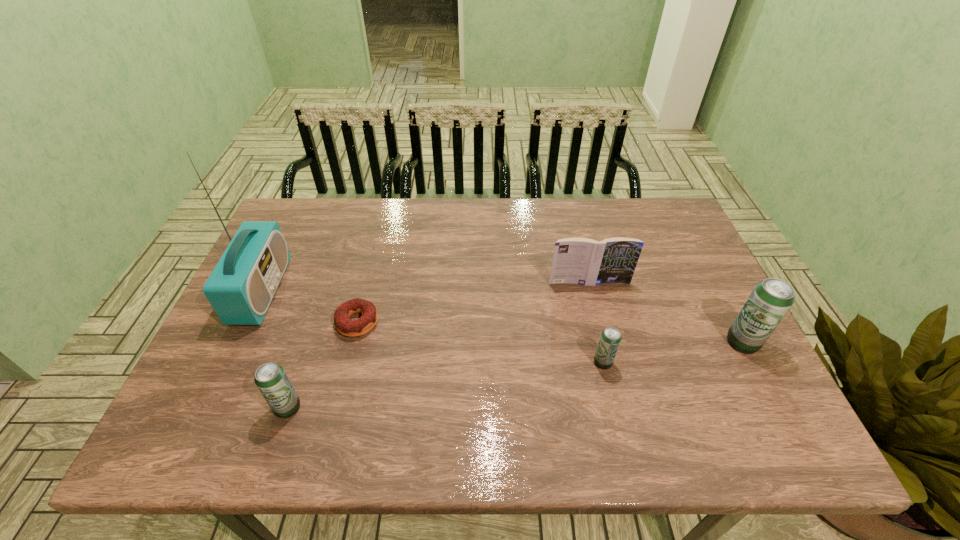
The width and height of the screenshot is (960, 540). In order to click on vacant space at the far edge of the desktop in this screenshot , I will do `click(402, 219)`.

Identify the location of vacant space at the near edge of the desktop. The width and height of the screenshot is (960, 540). (468, 375).

Locate an element on the screen. The height and width of the screenshot is (540, 960). vacant space at the left edge of the desktop is located at coordinates (264, 330).

Image resolution: width=960 pixels, height=540 pixels. I want to click on vacant space at the right edge of the desktop, so pyautogui.click(x=654, y=250).

Where is `blank space at the far left corner of the desktop`? The height and width of the screenshot is (540, 960). blank space at the far left corner of the desktop is located at coordinates (287, 238).

The image size is (960, 540). In the image, there is a desktop. What are the coordinates of `blank space at the far right corner` in the screenshot? It's located at (683, 225).

You are a GUI agent. You are given a task and a screenshot of the screen. Output one action in this format:
    pyautogui.click(x=<x>, y=<y>)
    Task: Click on the vacant region between the radio receiver and the rightmost beer can
    Image resolution: width=960 pixels, height=540 pixels.
    Given the screenshot: What is the action you would take?
    pyautogui.click(x=502, y=316)

Where is `vacant region between the rightmost beer can and the book`? vacant region between the rightmost beer can and the book is located at coordinates (665, 312).

Locate an element on the screen. The height and width of the screenshot is (540, 960). free space between the nearest beer can and the book is located at coordinates (439, 345).

The height and width of the screenshot is (540, 960). In order to click on vacant space in between the nearest beer can and the doughnut in this screenshot , I will do `click(323, 365)`.